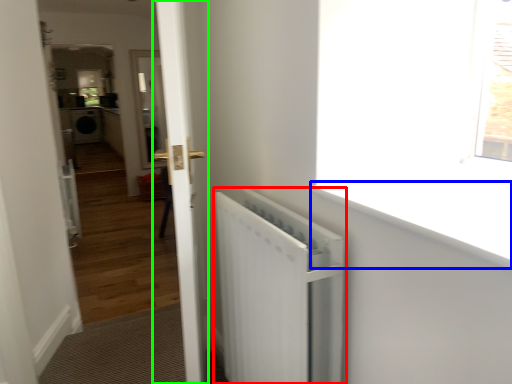
Question: Considering the real-world distances, which object is closest to radiator (highlighted by a red box)? window sill (highlighted by a blue box) or door (highlighted by a green box).

Choices:
 (A) window sill
 (B) door

Answer: (B)